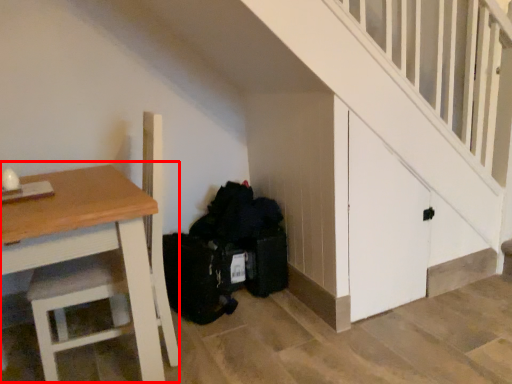
Question: Where is table (annotated by the red box) located in relation to garbage in the image?

Choices:
 (A) right
 (B) left

Answer: (B)